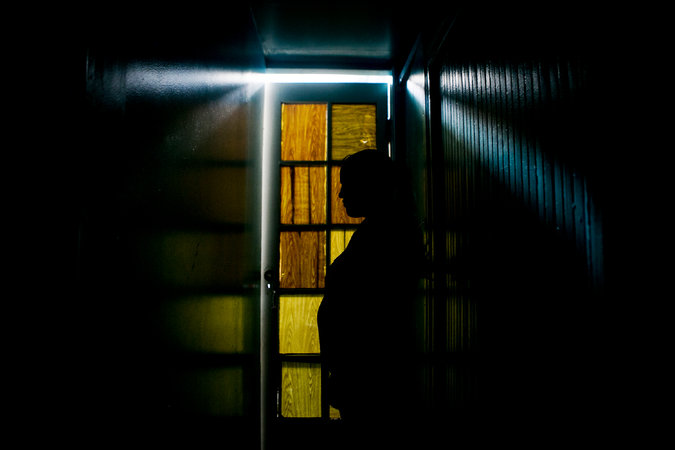
The width and height of the screenshot is (675, 450). Find the location of `door handle`. door handle is located at coordinates (x=265, y=278).